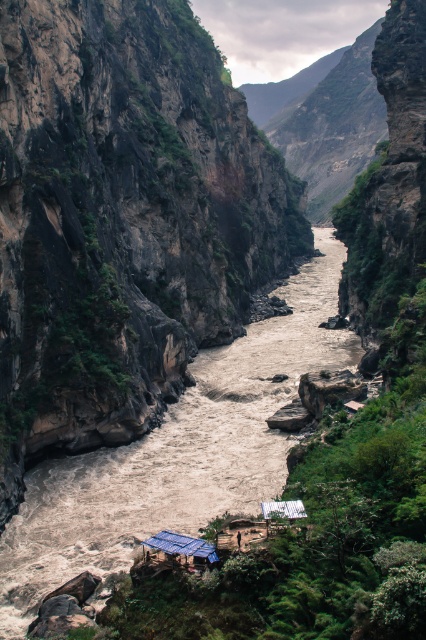
Can you confirm if blue corrugated metal hut at center is bigger than white corrugated metal hut at center?

Indeed, blue corrugated metal hut at center has a larger size compared to white corrugated metal hut at center.

What are the coordinates of `blue corrugated metal hut at center` in the screenshot? It's located at (178, 550).

Is point (46, 468) closer to camera compared to point (302, 515)?

No, (46, 468) is further to viewer.

Is point (68, 554) closer to viewer compared to point (290, 500)?

That is False.

Find the location of a particular element. This screenshot has width=426, height=640. brown muddy water at center is located at coordinates (178, 452).

Is brown muddy water at center closer to camera compared to blue corrugated metal hut at center?

No, it is not.

Which of these two, brown muddy water at center or blue corrugated metal hut at center, stands taller?

With more height is brown muddy water at center.

Is point (83, 456) in front of point (152, 548)?

No, (83, 456) is further to viewer.

Find the location of a particular element. brown muddy water at center is located at coordinates (178, 452).